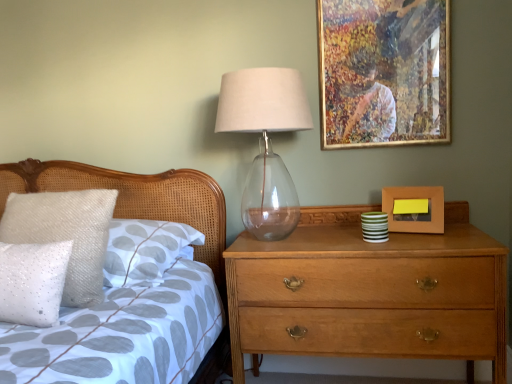
Question: From their relative heights in the image, would you say white sequined pillow at left, the second pillow from the back, is taller or shorter than white sequined pillow at left, which is the first pillow from back to front?

Choices:
 (A) short
 (B) tall

Answer: (A)

Question: In the image, is white sequined pillow at left, the second pillow from the back, on the left side or the right side of white sequined pillow at left, which is the 2th pillow from front to back?

Choices:
 (A) left
 (B) right

Answer: (A)

Question: Which of these objects is positioned closest to the white sequined pillow at left, which is the 2th pillow from front to back?

Choices:
 (A) white sequined pillow at left, which is the 1th pillow in front-to-back order
 (B) gold-framed artwork at upper right, which ranks as the 2th picture frame in bottom-to-top order
 (C) wooden picture frame at right, which is the 1th picture frame in bottom-to-top order
 (D) light brown wooden chest of drawers at right
 (E) transparent glass table lamp at upper center

Answer: (A)

Question: Which of these objects is positioned farthest from the gold-framed artwork at upper right, which ranks as the 2th picture frame in bottom-to-top order?

Choices:
 (A) white sequined pillow at left, the second pillow from the back
 (B) white sequined pillow at left, which is the first pillow from back to front
 (C) transparent glass table lamp at upper center
 (D) light brown wooden chest of drawers at right
 (E) wooden picture frame at right, arranged as the 2th picture frame when viewed from the top

Answer: (A)